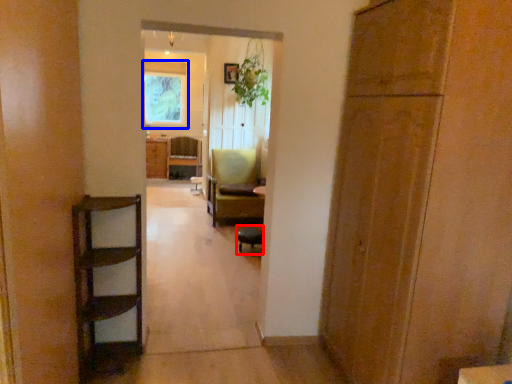
Question: Which point is further to the camera, chair (highlighted by a red box) or window (highlighted by a blue box)?

Choices:
 (A) chair
 (B) window

Answer: (B)